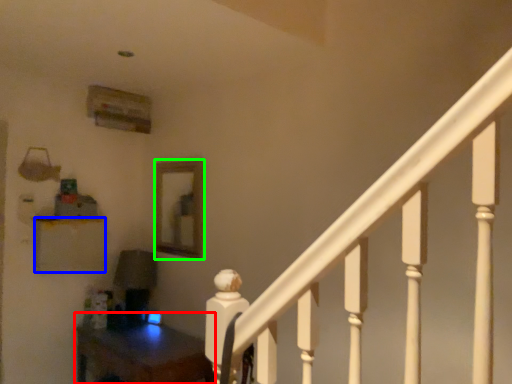
Question: Which object is the farthest from table (highlighted by a red box)? Choose among these: furniture (highlighted by a blue box) or mirror (highlighted by a green box).

Choices:
 (A) furniture
 (B) mirror

Answer: (B)